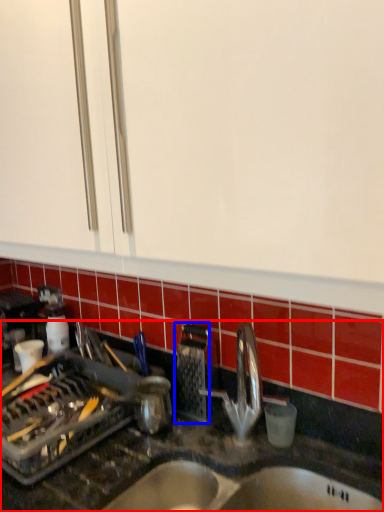
Question: Which point is closer to the camera, countertop (highlighted by a red box) or appliance (highlighted by a blue box)?

Choices:
 (A) countertop
 (B) appliance

Answer: (A)